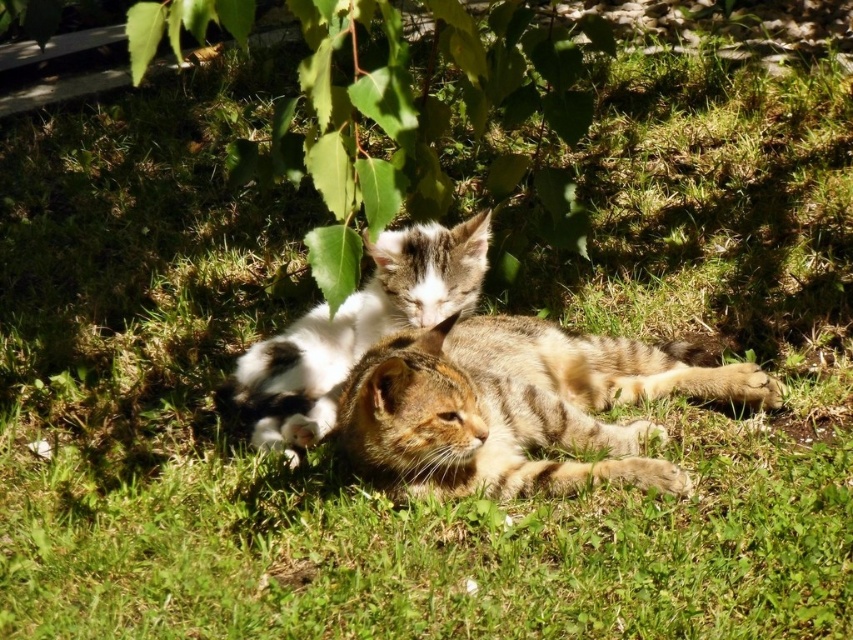
From the picture: You are a photographer trying to capture both cats in a single shot. Since the tabby fur cat at center and the white fur cat at center are at different heights, which cat should you focus on first to ensure both are in focus?

The tabby fur cat at center has a lesser height compared to white fur cat at center. To ensure both are in focus, you should focus on the tabby fur cat at center first, as it is closer to the camera, allowing the depth of field to cover the taller white fur cat at center.

You are a photographer trying to capture both cats in a single shot. Since you want to focus on the tabby fur cat at center, will the white fur cat at center be partially hidden in the photo?

Yes, the white fur cat at center will be partially hidden because the tabby fur cat at center is in front of it.